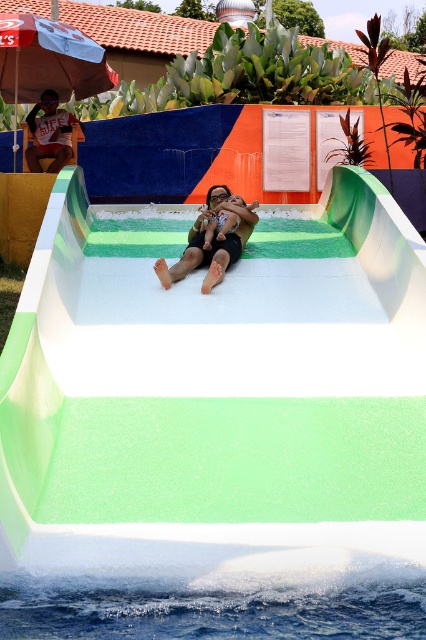
Is green rubber pool at center to the left of white fabric umbrella at upper left from the viewer's perspective?

No, green rubber pool at center is not to the left of white fabric umbrella at upper left.

Between green rubber pool at center and white fabric umbrella at upper left, which one appears on the left side from the viewer's perspective?

white fabric umbrella at upper left

Where is `green rubber pool at center`? Image resolution: width=426 pixels, height=640 pixels. green rubber pool at center is located at coordinates (215, 401).

Identify the location of green rubber pool at center. This screenshot has width=426, height=640. (215, 401).

Who is taller, matte white person at center or matte black swimsuit at center?

Standing taller between the two is matte white person at center.

Describe the element at coordinates (212, 243) in the screenshot. The height and width of the screenshot is (640, 426). I see `matte white person at center` at that location.

In order to click on matte white person at center in this screenshot , I will do `click(212, 243)`.

Is the position of matte white person at center more distant than that of transparent plastic goggles at upper center?

No.

Is point (218, 225) in front of point (213, 193)?

Yes.

Who is more forward, [252,202] or [215,193]?

Point [252,202] is in front.

The image size is (426, 640). I want to click on matte white person at center, so click(212, 243).